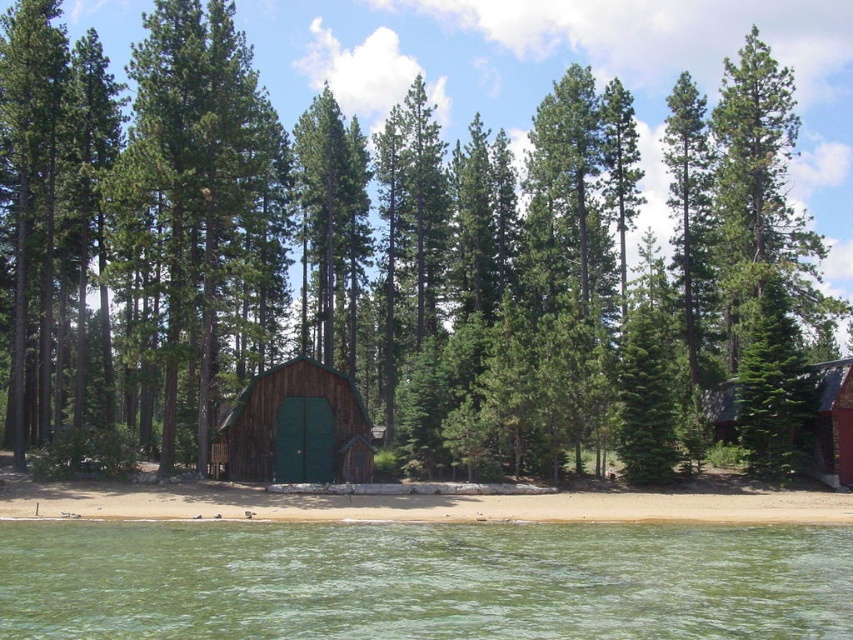
Measure the distance between green woodshed at center and camera.

154.51 feet

Can you confirm if green woodshed at center is shorter than red brick cabin at right?

Yes.

This screenshot has width=853, height=640. What do you see at coordinates (297, 428) in the screenshot?
I see `green woodshed at center` at bounding box center [297, 428].

Where is `green woodshed at center`? The width and height of the screenshot is (853, 640). green woodshed at center is located at coordinates (297, 428).

Who is positioned more to the left, sandy shore at lower center or red brick cabin at right?

sandy shore at lower center is more to the left.

How much distance is there between sandy shore at lower center and red brick cabin at right?

sandy shore at lower center is 40.01 feet from red brick cabin at right.

The width and height of the screenshot is (853, 640). What do you see at coordinates (415, 504) in the screenshot?
I see `sandy shore at lower center` at bounding box center [415, 504].

The image size is (853, 640). In order to click on sandy shore at lower center in this screenshot , I will do coord(415,504).

Which is behind, point (614, 604) or point (850, 432)?

Positioned behind is point (850, 432).

From the picture: Is green water at lower center positioned before red brick cabin at right?

That is True.

Between point (653, 525) and point (848, 474), which one is positioned behind?

The point (848, 474) is more distant.

Where is `green water at lower center`? The width and height of the screenshot is (853, 640). green water at lower center is located at coordinates (422, 580).